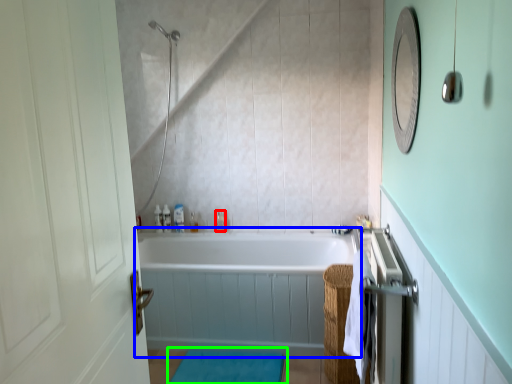
Question: Based on their relative distances, which object is nearer to toiletry (highlighted by a red box)? Choose from bathtub (highlighted by a blue box) and bath mat (highlighted by a green box).

Choices:
 (A) bathtub
 (B) bath mat

Answer: (A)